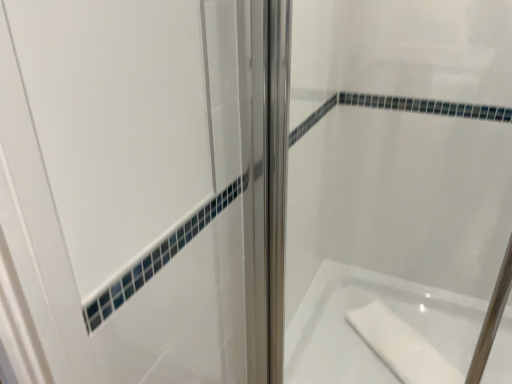
Question: Considering the relative sizes of clear glass shower door at center and white glossy bathtub at lower right in the image provided, is clear glass shower door at center bigger than white glossy bathtub at lower right?

Choices:
 (A) no
 (B) yes

Answer: (A)

Question: Is clear glass shower door at center looking in the opposite direction of white glossy bathtub at lower right?

Choices:
 (A) no
 (B) yes

Answer: (B)

Question: Is clear glass shower door at center behind white glossy bathtub at lower right?

Choices:
 (A) no
 (B) yes

Answer: (A)

Question: Does clear glass shower door at center turn towards white glossy bathtub at lower right?

Choices:
 (A) no
 (B) yes

Answer: (A)

Question: Considering the relative positions of clear glass shower door at center and white glossy bathtub at lower right in the image provided, is clear glass shower door at center to the left of white glossy bathtub at lower right from the viewer's perspective?

Choices:
 (A) no
 (B) yes

Answer: (B)

Question: From the image's perspective, does clear glass shower door at center appear lower than white glossy bathtub at lower right?

Choices:
 (A) no
 (B) yes

Answer: (A)

Question: Is white matte soap at lower right in contact with clear glass shower door at center?

Choices:
 (A) no
 (B) yes

Answer: (A)

Question: Is white matte soap at lower right completely or partially outside of clear glass shower door at center?

Choices:
 (A) yes
 (B) no

Answer: (A)

Question: From a real-world perspective, is white matte soap at lower right below clear glass shower door at center?

Choices:
 (A) yes
 (B) no

Answer: (A)

Question: Is white matte soap at lower right smaller than clear glass shower door at center?

Choices:
 (A) yes
 (B) no

Answer: (A)

Question: Are white matte soap at lower right and clear glass shower door at center located far from each other?

Choices:
 (A) no
 (B) yes

Answer: (A)

Question: Does white matte soap at lower right come in front of clear glass shower door at center?

Choices:
 (A) no
 (B) yes

Answer: (A)

Question: Is white glossy bathtub at lower right with clear glass shower door at center?

Choices:
 (A) no
 (B) yes

Answer: (A)